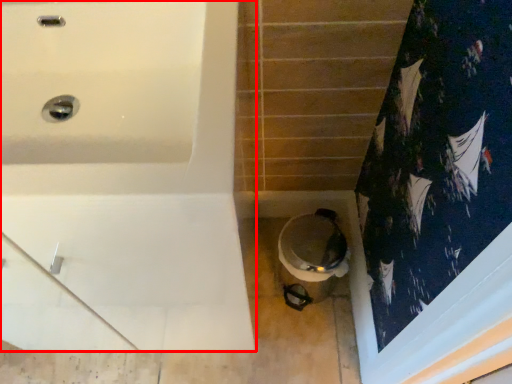
Question: From the image's perspective, considering the relative positions of bathtub (annotated by the red box) and toilet in the image provided, where is bathtub (annotated by the red box) located with respect to the staircase?

Choices:
 (A) above
 (B) below

Answer: (A)